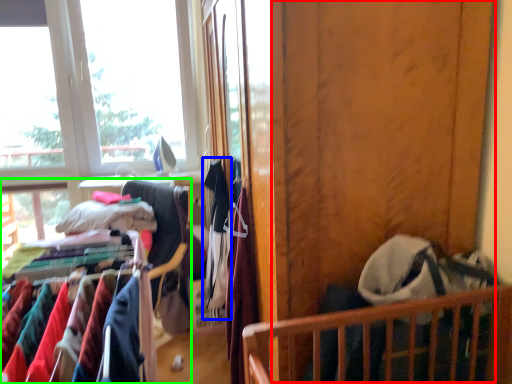
Question: Based on their relative distances, which object is nearer to screen door (highlighted by a red box)? Choose from clothing (highlighted by a blue box) and closet (highlighted by a green box).

Choices:
 (A) clothing
 (B) closet

Answer: (A)